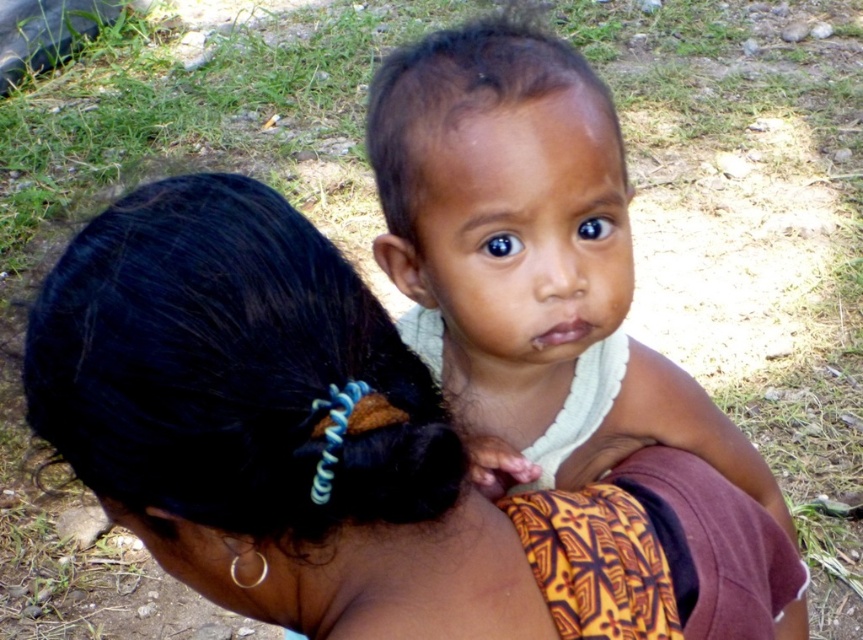
Who is more distant from viewer, [208,456] or [382,150]?

Positioned behind is point [382,150].

Does black hair at upper left have a larger size compared to smooth skin baby at center?

No.

Describe the element at coordinates (348, 451) in the screenshot. I see `black hair at upper left` at that location.

Identify the location of black hair at upper left. The image size is (863, 640). (348, 451).